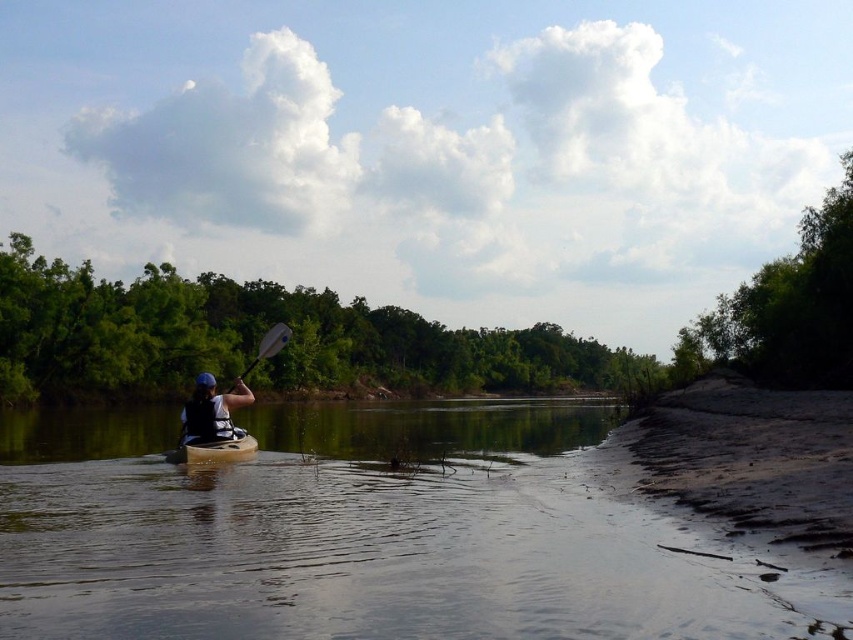
You are a drone operator tasked with capturing aerial footage of the river scene. The drone needs to hover directly above the matte black kayak at center to get the best shot. According to the coordinates provided, what are the exact 2D coordinates where the drone should position itself?

The drone should position itself at the exact 2D coordinates of the matte black kayak at center, which is at point (x=212, y=412).